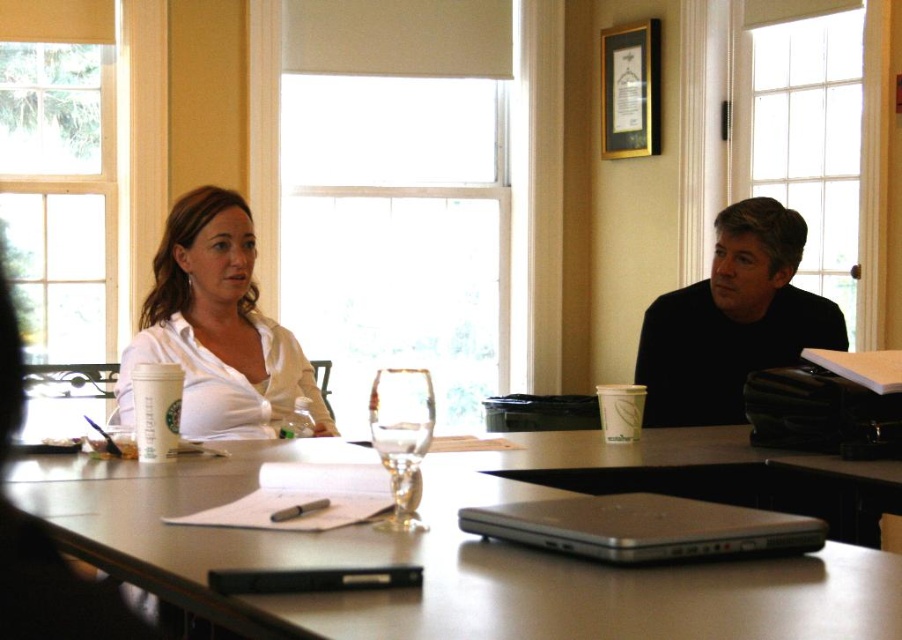
What object is located at the coordinates point (x=643, y=529) in the image?

The silver metallic laptop at center is located at the coordinates point (x=643, y=529) in the image.

You are an office worker who needs to reach the silver metallic laptop at center to retrieve a pen. However, there is a black matte shirt at right in the way. Can you easily access the laptop without moving the shirt?

The black matte shirt at right is further to the viewer than the silver metallic laptop at center, so the shirt is actually behind the laptop. Therefore, you can easily access the laptop without moving the shirt.

You are standing at the entrance of the conference room. You need to place a new object exactly at the coordinates where the silver metallic laptop at center is located. What object is currently occupying that spot?

The silver metallic laptop at center is currently occupying the coordinates at point [643,529].